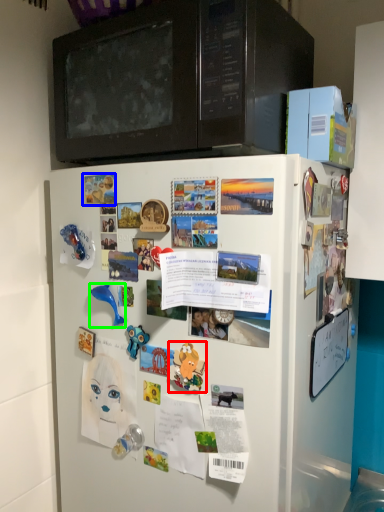
Question: Which is farther away from toy (highlighted by a red box)? poster (highlighted by a blue box) or toy (highlighted by a green box)?

Choices:
 (A) poster
 (B) toy

Answer: (A)